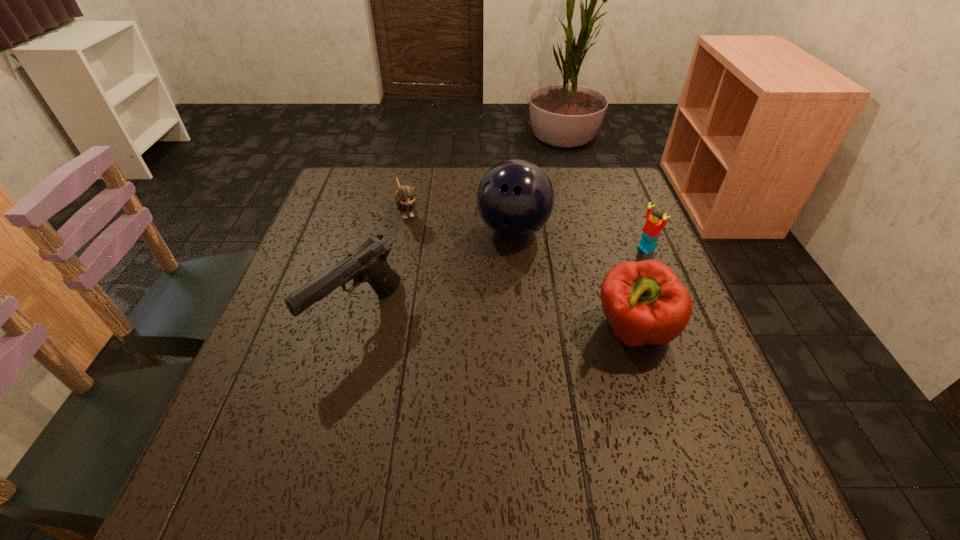
Find the location of `Lego that is at the right edge`. Lego that is at the right edge is located at coordinates (653, 226).

You are a GUI agent. You are given a task and a screenshot of the screen. Output one action in this format:
    pyautogui.click(x=<x>, y=<y>)
    Task: Click on the vacant space at the far edge
    The width and height of the screenshot is (960, 540).
    Given the screenshot: What is the action you would take?
    pyautogui.click(x=562, y=178)

Where is `free spot at the near edge of the desktop`? The height and width of the screenshot is (540, 960). free spot at the near edge of the desktop is located at coordinates (481, 409).

You are a GUI agent. You are given a task and a screenshot of the screen. Output one action in this format:
    pyautogui.click(x=<x>, y=<y>)
    Task: Click on the free location at the left edge of the desktop
    The image size is (960, 540).
    Given the screenshot: What is the action you would take?
    pyautogui.click(x=345, y=251)

In order to click on free space at the right edge of the desktop in this screenshot , I will do `click(617, 262)`.

Identify the location of vacant space at the far left corner of the desktop. This screenshot has width=960, height=540. (360, 168).

At what (x,y) coordinates should I click in order to perform the action: click on free space at the far right corner of the desktop. Please return your answer as a coordinate pair (x, y). This screenshot has width=960, height=540. Looking at the image, I should click on [606, 179].

This screenshot has height=540, width=960. In the image, there is a desktop. Find the location of `vacant region at the near right corner`. vacant region at the near right corner is located at coordinates (646, 409).

This screenshot has width=960, height=540. What are the coordinates of `free area in between the Lego and the gun` in the screenshot? It's located at (501, 282).

The image size is (960, 540). What are the coordinates of `vacant area between the kitten and the bell pepper` in the screenshot? It's located at (520, 271).